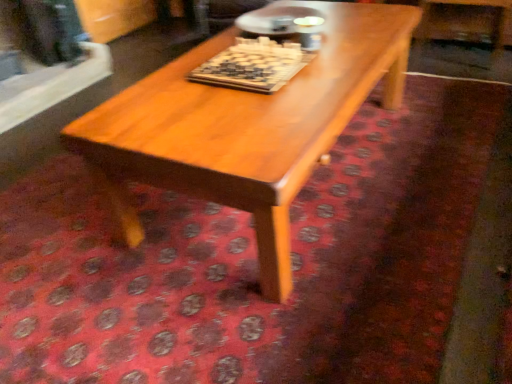
Question: Should I look upward or downward to see wooden chessboard at center?

Choices:
 (A) down
 (B) up

Answer: (B)

Question: From a real-world perspective, is light brown wood coffee table at center on top of wooden chessboard at center?

Choices:
 (A) yes
 (B) no

Answer: (B)

Question: Is light brown wood coffee table at center beside wooden chessboard at center?

Choices:
 (A) yes
 (B) no

Answer: (B)

Question: Does light brown wood coffee table at center have a smaller size compared to wooden chessboard at center?

Choices:
 (A) no
 (B) yes

Answer: (A)

Question: Is light brown wood coffee table at center bigger than wooden chessboard at center?

Choices:
 (A) yes
 (B) no

Answer: (A)

Question: Is light brown wood coffee table at center to the right of wooden chessboard at center from the viewer's perspective?

Choices:
 (A) yes
 (B) no

Answer: (A)

Question: From the image's perspective, would you say light brown wood coffee table at center is positioned over wooden chessboard at center?

Choices:
 (A) no
 (B) yes

Answer: (A)

Question: From the image's perspective, is wooden chessboard at center under light brown wood coffee table at center?

Choices:
 (A) no
 (B) yes

Answer: (A)

Question: From a real-world perspective, does wooden chessboard at center stand above light brown wood coffee table at center?

Choices:
 (A) yes
 (B) no

Answer: (A)

Question: Is wooden chessboard at center not inside light brown wood coffee table at center?

Choices:
 (A) no
 (B) yes

Answer: (B)

Question: Can you confirm if wooden chessboard at center is thinner than light brown wood coffee table at center?

Choices:
 (A) no
 (B) yes

Answer: (B)

Question: Does wooden chessboard at center have a larger size compared to light brown wood coffee table at center?

Choices:
 (A) no
 (B) yes

Answer: (A)

Question: Is wooden chessboard at center to the right of light brown wood coffee table at center from the viewer's perspective?

Choices:
 (A) no
 (B) yes

Answer: (A)

Question: In terms of width, does wooden chessboard at center look wider or thinner when compared to light brown wood coffee table at center?

Choices:
 (A) wide
 (B) thin

Answer: (B)